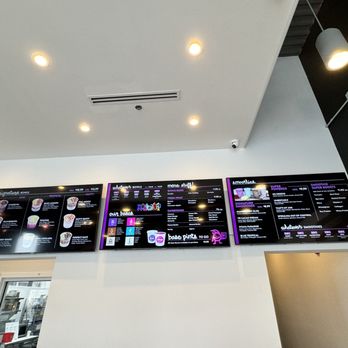
Find the location of `purple vertical strip on left hand edge of black board`. purple vertical strip on left hand edge of black board is located at coordinates (106, 204), (232, 209).